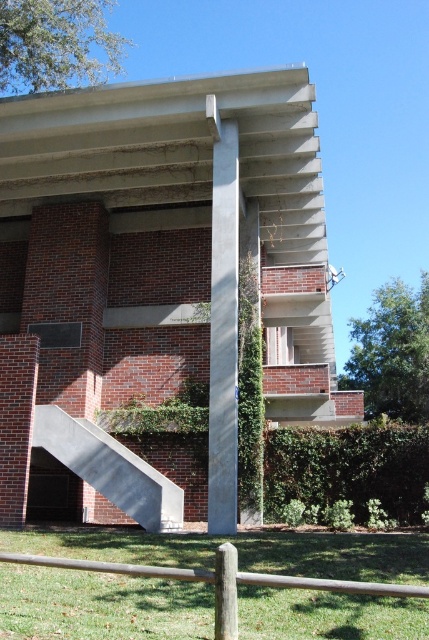
Question: Can you confirm if brown wooden post at lower center is wider than wooden post at lower center?

Choices:
 (A) yes
 (B) no

Answer: (A)

Question: Considering the relative positions of concrete pillar at center and brown wooden post at lower center in the image provided, where is concrete pillar at center located with respect to brown wooden post at lower center?

Choices:
 (A) above
 (B) below

Answer: (A)

Question: Can you confirm if concrete/stone staircase at lower left is wider than wooden post at lower center?

Choices:
 (A) no
 (B) yes

Answer: (B)

Question: Which of the following is the closest to the observer?

Choices:
 (A) concrete pillar at center
 (B) brown wooden post at lower center

Answer: (B)

Question: Which object is positioned closest to the concrete pillar at center?

Choices:
 (A) concrete/stone staircase at lower left
 (B) wooden post at lower center

Answer: (A)

Question: Which point is farther to the camera?

Choices:
 (A) brown wooden post at lower center
 (B) concrete/stone staircase at lower left
 (C) wooden post at lower center
 (D) green grass at lower center

Answer: (B)